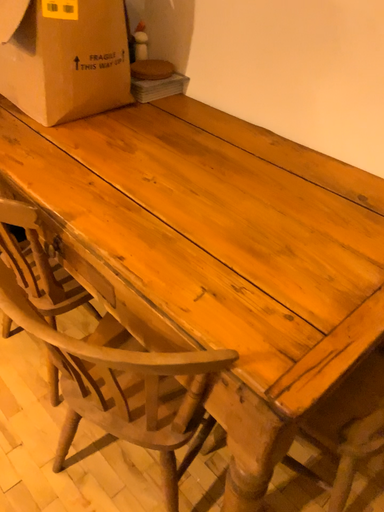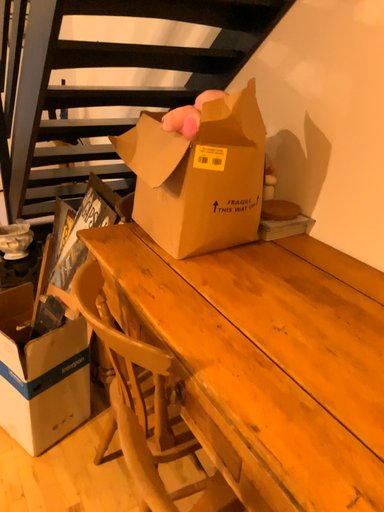
Question: How did the camera likely rotate when shooting the video?

Choices:
 (A) rotated right
 (B) rotated left

Answer: (B)